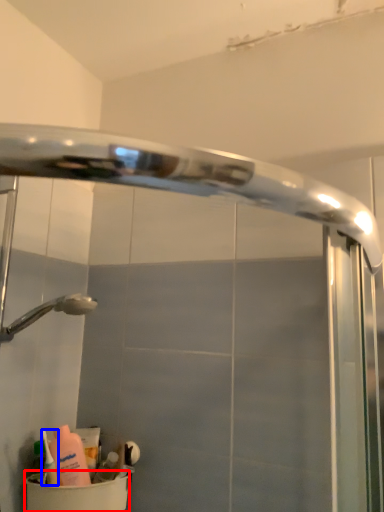
Question: Which object appears farthest to the camera in this image, toilet bowl (highlighted by a red box) or cleaning product (highlighted by a blue box)?

Choices:
 (A) toilet bowl
 (B) cleaning product

Answer: (B)